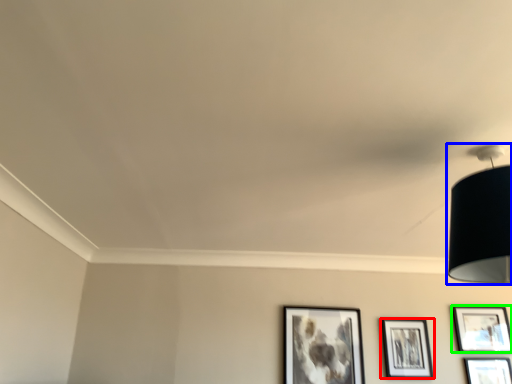
Question: Considering the real-world distances, which object is farthest from picture frame (highlighted by a red box)? lamp (highlighted by a blue box) or picture frame (highlighted by a green box)?

Choices:
 (A) lamp
 (B) picture frame

Answer: (A)